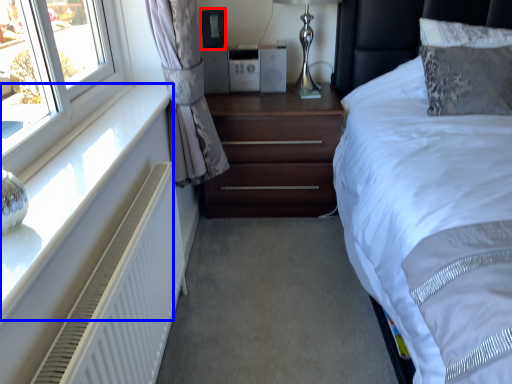
Question: Which object appears closest to the camera in this image, speaker (highlighted by a red box) or window sill (highlighted by a blue box)?

Choices:
 (A) speaker
 (B) window sill

Answer: (B)